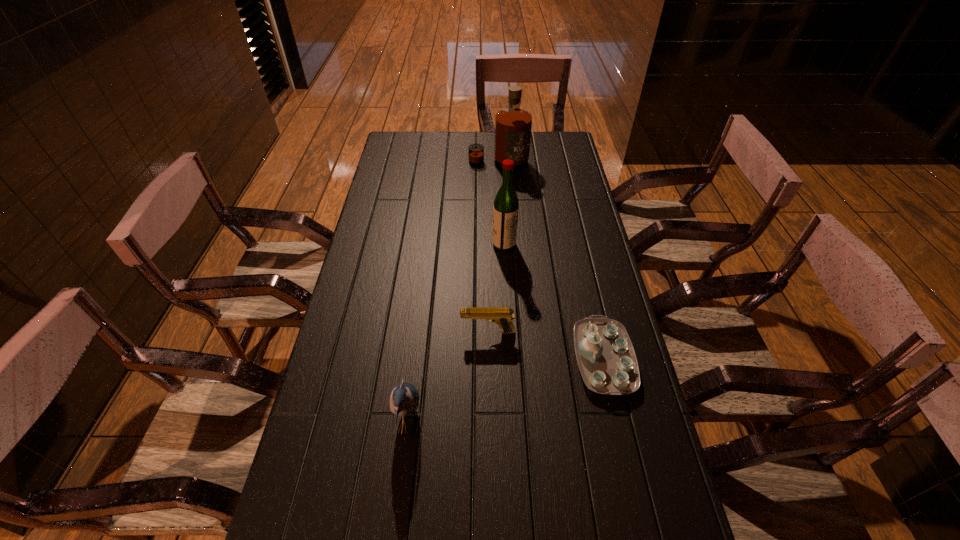
The width and height of the screenshot is (960, 540). Identify the location of free space between the bird and the nearer liquor. (456, 334).

Locate an element on the screen. The width and height of the screenshot is (960, 540). empty location between the rightmost object and the pistol is located at coordinates (545, 345).

This screenshot has height=540, width=960. Identify the location of vacant point located between the nearer liquor and the chinaware. [554, 301].

Where is `vacant area between the rightmost object and the farthest object`? The image size is (960, 540). vacant area between the rightmost object and the farthest object is located at coordinates (551, 261).

Locate an element on the screen. This screenshot has width=960, height=540. free space that is in between the nearer liquor and the chinaware is located at coordinates (554, 301).

At what (x,y) coordinates should I click in order to perform the action: click on vacant space that is in between the pistol and the bird. Please return your answer as a coordinate pair (x, y). Looking at the image, I should click on (448, 378).

Locate an element on the screen. This screenshot has height=540, width=960. empty space between the pistol and the chinaware is located at coordinates (545, 345).

You are a GUI agent. You are given a task and a screenshot of the screen. Output one action in this format:
    pyautogui.click(x=<x>, y=<y>)
    Task: Click on the free spot between the pistol and the third shortest object
    
    Given the screenshot: What is the action you would take?
    pyautogui.click(x=448, y=378)

Locate an element on the screen. This screenshot has width=960, height=540. free space between the pistol and the chinaware is located at coordinates (545, 345).

Locate which object ranks in proximity to the leftmost object. Please provide its 2D coordinates. Your answer should be formatted as a tuple, i.e. [(x, y)], where the tuple contains the x and y coordinates of a point satisfying the conditions above.

[(502, 316)]